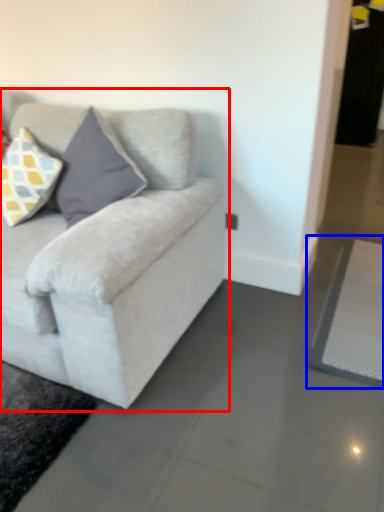
Question: Which object appears closest to the camera in this image, studio couch (highlighted by a red box) or yoga mat (highlighted by a blue box)?

Choices:
 (A) studio couch
 (B) yoga mat

Answer: (A)